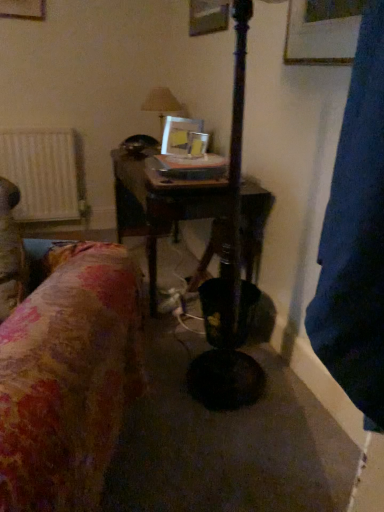
Question: Relative to matte white lampshade at center, is metallic silver picture frame at center in front or behind?

Choices:
 (A) front
 (B) behind

Answer: (A)

Question: Is point (162, 131) positioned closer to the camera than point (163, 113)?

Choices:
 (A) closer
 (B) farther

Answer: (B)

Question: Which object is positioned closest to the metallic silver picture frame at center?

Choices:
 (A) wooden table at center
 (B) white textured radiator at left
 (C) matte white lampshade at center

Answer: (C)

Question: Which object is the closest to the metallic silver picture frame at center?

Choices:
 (A) wooden table at center
 (B) matte white lampshade at center
 (C) white textured radiator at left

Answer: (B)